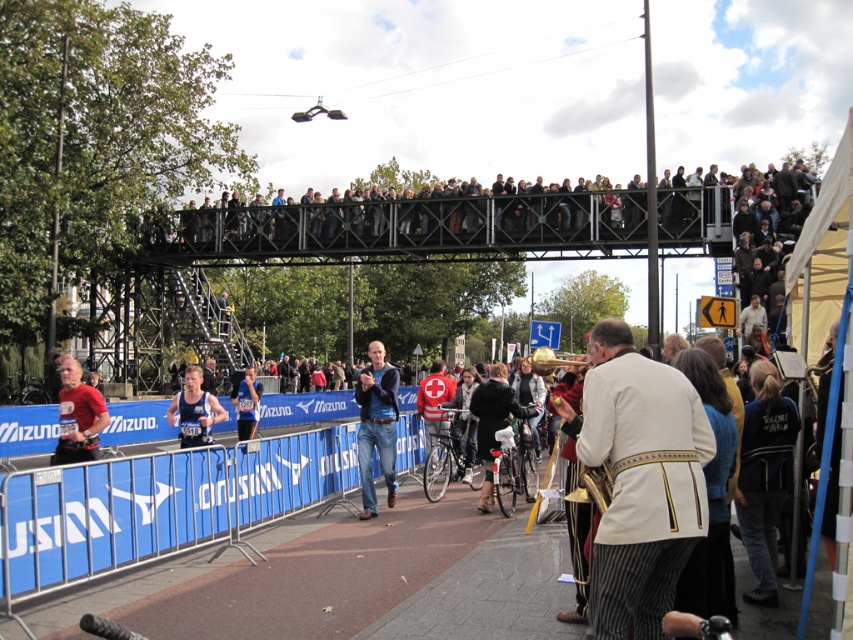
You are a photographer positioned at the lower left of the scene. You need to take a photo of the velvet black coat at center without the blue fabric barrier at lower left blocking the view. Is the barrier likely to obstruct the coat in your shot?

The blue fabric barrier at lower left is shorter than the velvet black coat at center, so the barrier will not obstruct the view of the coat as it is shorter and the coat is taller.

You are a photographer standing at the center of the image. You want to take a photo of the matte red shirt at lower left. Based on its coordinates, in which direction should you move to get the best shot?

The matte red shirt at lower left is located at coordinates point (78, 417). To get the best shot, you should move to the lower left direction to align with the shirt.

You are standing at the center of the image and want to move towards the point marked at coordinate point (161, 506). Which direction should you go?

The point (161, 506) is on the blue fabric barrier at lower left, so you should move towards the lower left direction to reach it.